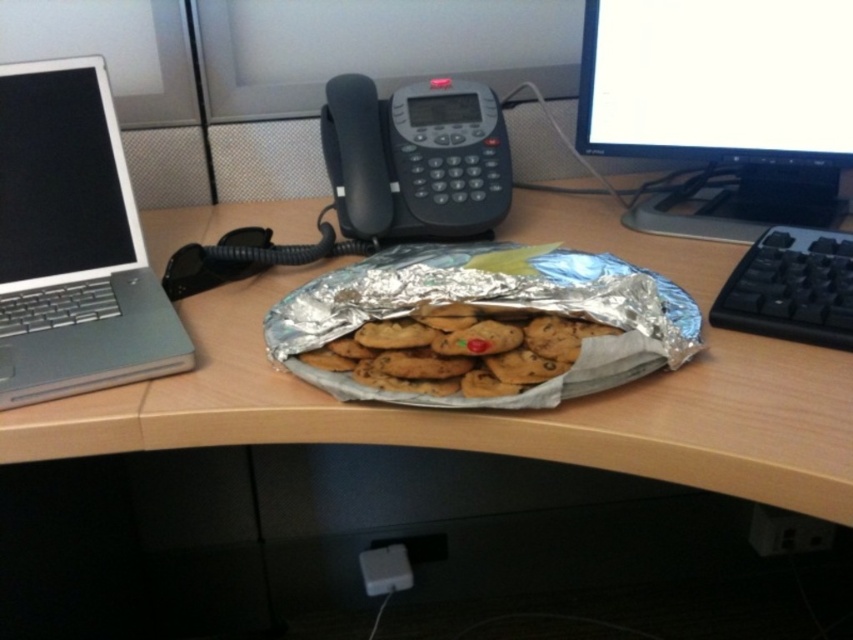
You are organizing your desk and want to place a new item between the matte black monitor at upper right and the black plastic keyboard at right. Based on their sizes, which object should you place the item closer to?

The matte black monitor at upper right is taller than the black plastic keyboard at right, so you should place the new item closer to the black plastic keyboard at right to maintain balance between the two objects.

You are organizing the desk and need to place a new item between the matte black monitor at upper right and the golden brown cookie dough at center. Is there enough space for the item if it requires 10 cm of space?

The matte black monitor at upper right is to the right of golden brown cookie dough at center, but the exact distance between them isn

You are organizing your workspace and need to move the black plastic keyboard at right closer to the wooden desk at center. Based on their positions, will moving the keyboard towards the desk require you to place it in front of or behind the desk?

The wooden desk at center is in front of the black plastic keyboard at right, so moving the keyboard closer to the desk would mean placing it behind the desk.